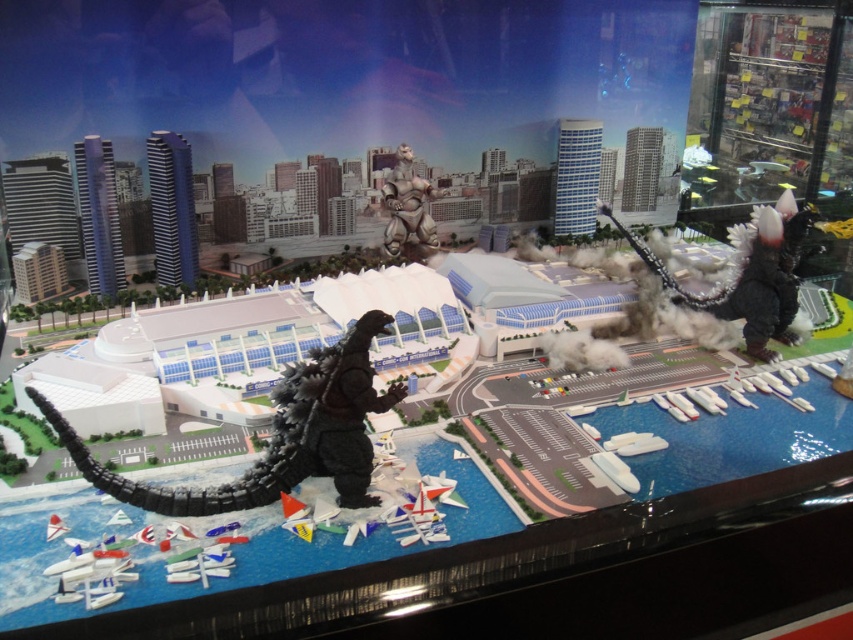
Question: Among these objects, which one is farthest from the camera?

Choices:
 (A) satin black godzilla at right
 (B) metallic silver robot at center

Answer: (B)

Question: Is black matte toy at center positioned before satin black godzilla at right?

Choices:
 (A) yes
 (B) no

Answer: (A)

Question: Is black matte toy at center further to camera compared to metallic silver robot at center?

Choices:
 (A) yes
 (B) no

Answer: (B)

Question: Is black matte toy at center to the right of metallic silver robot at center from the viewer's perspective?

Choices:
 (A) yes
 (B) no

Answer: (B)

Question: Which object appears closest to the camera in this image?

Choices:
 (A) black matte toy at center
 (B) satin black godzilla at right
 (C) metallic silver robot at center

Answer: (A)

Question: Which point appears farthest from the camera in this image?

Choices:
 (A) (795, 308)
 (B) (299, 440)

Answer: (A)